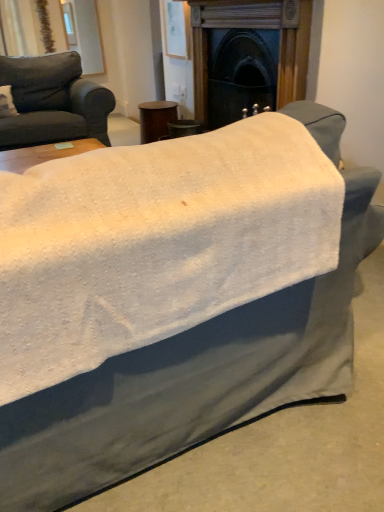
Question: From a real-world perspective, is brown wood side table at center located beneath dark wood fireplace at center?

Choices:
 (A) yes
 (B) no

Answer: (A)

Question: Is brown wood side table at center not inside dark wood fireplace at center?

Choices:
 (A) yes
 (B) no

Answer: (A)

Question: From the image's perspective, is brown wood side table at center on dark wood fireplace at center?

Choices:
 (A) no
 (B) yes

Answer: (B)

Question: Is brown wood side table at center at the left side of dark wood fireplace at center?

Choices:
 (A) yes
 (B) no

Answer: (A)

Question: Are brown wood side table at center and dark wood fireplace at center far apart?

Choices:
 (A) no
 (B) yes

Answer: (A)

Question: Is brown wood side table at center spatially inside matte gray couch at left, or outside of it?

Choices:
 (A) outside
 (B) inside

Answer: (A)

Question: Considering the positions of brown wood side table at center and matte gray couch at left in the image, is brown wood side table at center bigger or smaller than matte gray couch at left?

Choices:
 (A) small
 (B) big

Answer: (A)

Question: Looking at their shapes, would you say brown wood side table at center is wider or thinner than matte gray couch at left?

Choices:
 (A) thin
 (B) wide

Answer: (A)

Question: Does point (160, 103) appear closer or farther from the camera than point (74, 98)?

Choices:
 (A) farther
 (B) closer

Answer: (A)

Question: From a real-world perspective, is dark wood fireplace at center physically located above or below brown wood side table at center?

Choices:
 (A) below
 (B) above

Answer: (B)

Question: Is dark wood fireplace at center in front of or behind brown wood side table at center in the image?

Choices:
 (A) front
 (B) behind

Answer: (A)

Question: Considering the positions of dark wood fireplace at center and brown wood side table at center in the image, is dark wood fireplace at center wider or thinner than brown wood side table at center?

Choices:
 (A) wide
 (B) thin

Answer: (B)

Question: Would you say dark wood fireplace at center is to the left or to the right of brown wood side table at center in the picture?

Choices:
 (A) left
 (B) right

Answer: (B)

Question: Would you say dark wood fireplace at center is to the left or to the right of matte gray couch at left in the picture?

Choices:
 (A) right
 (B) left

Answer: (A)

Question: Considering the positions of dark wood fireplace at center and matte gray couch at left in the image, is dark wood fireplace at center bigger or smaller than matte gray couch at left?

Choices:
 (A) small
 (B) big

Answer: (A)